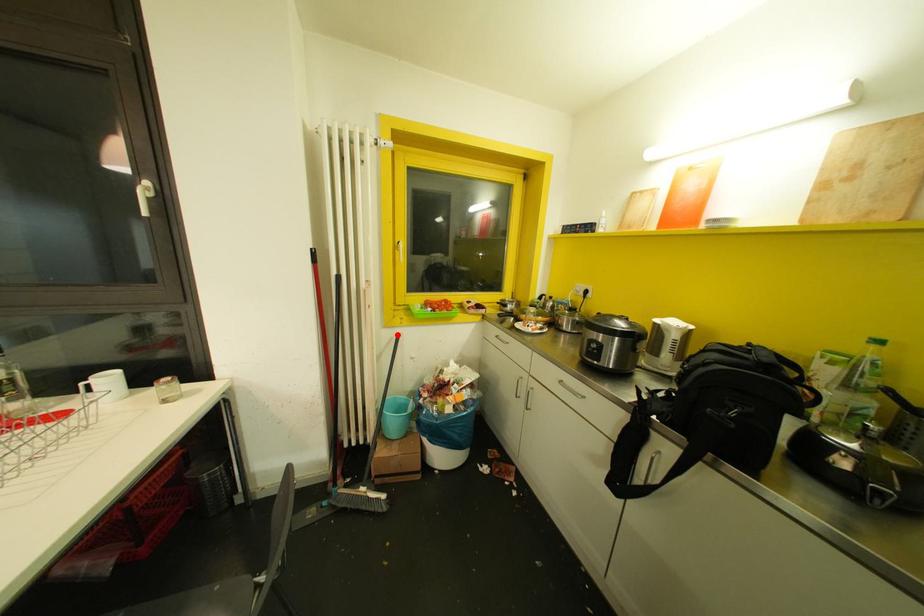
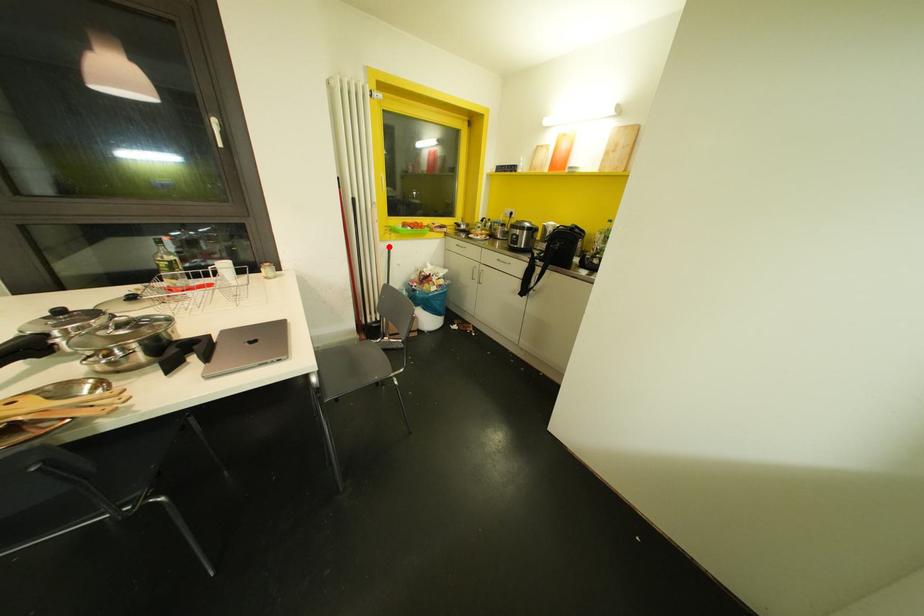
I am providing you with two images of the same scene from different viewpoints. A red point is marked on the first image and another point is marked on the second image. Are the points marked in image1 and image2 representing the same 3D position?

Yes